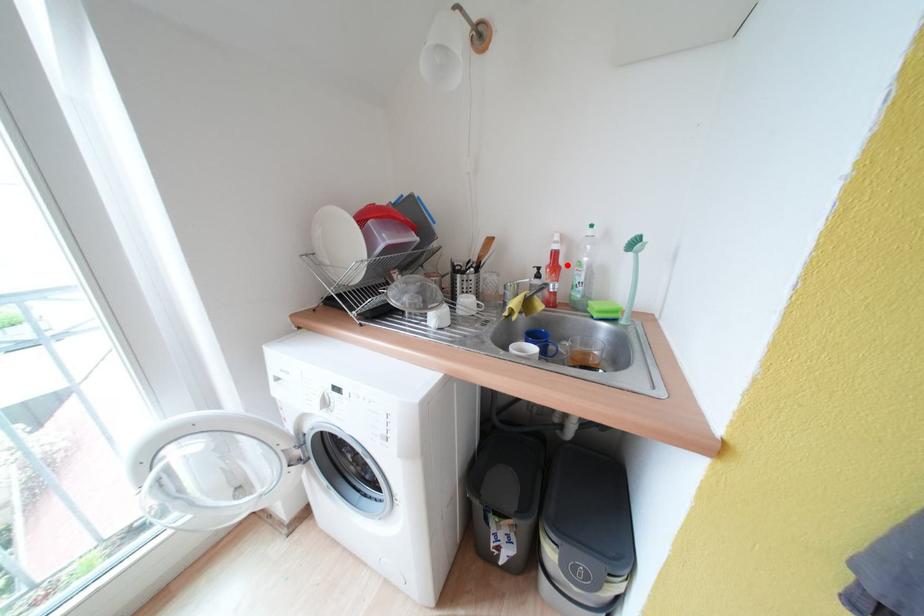
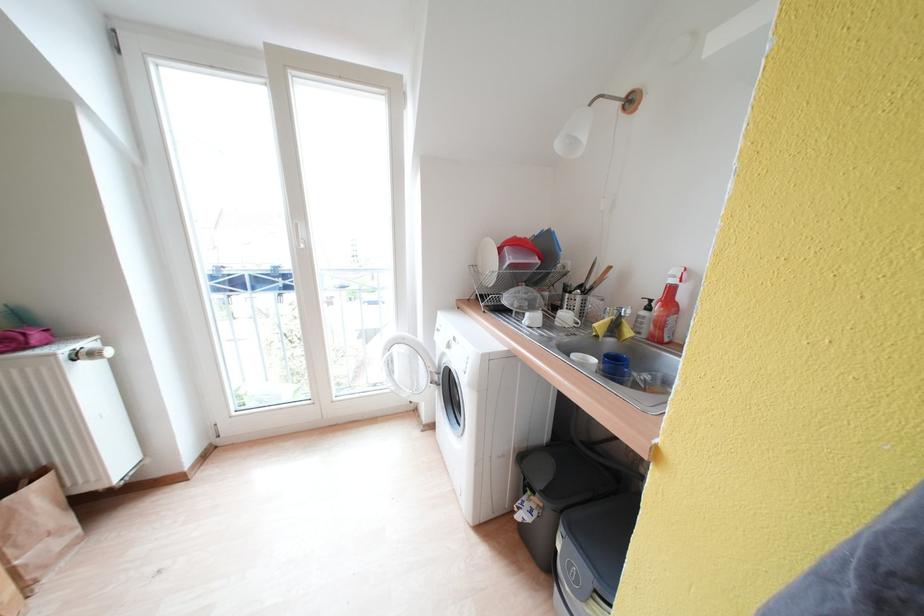
Find the pixel in the second image that matches the highlighted location in the first image.

(687, 302)